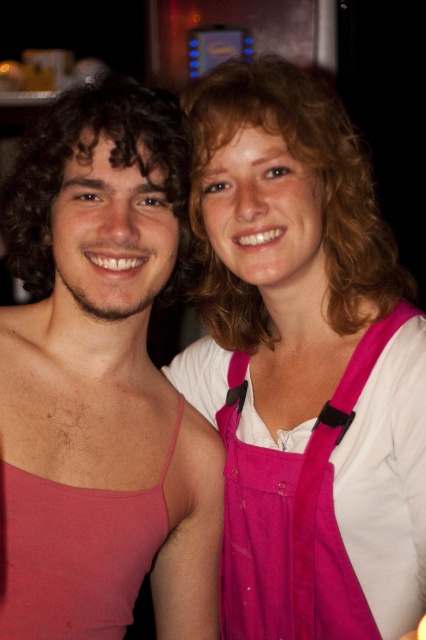
Question: Can you confirm if pink fabric dress at center is positioned to the right of pink matte tank top at center?

Choices:
 (A) yes
 (B) no

Answer: (A)

Question: Which point is closer to the camera?

Choices:
 (A) (94, 426)
 (B) (388, 420)

Answer: (B)

Question: Is pink fabric dress at center to the left of pink matte tank top at center from the viewer's perspective?

Choices:
 (A) no
 (B) yes

Answer: (A)

Question: Does pink fabric dress at center have a larger size compared to pink fabric apron at center?

Choices:
 (A) no
 (B) yes

Answer: (B)

Question: Which of the following is the closest to the observer?

Choices:
 (A) click(x=250, y=584)
 (B) click(x=161, y=381)
 (C) click(x=233, y=160)

Answer: (C)

Question: Among these objects, which one is farthest from the camera?

Choices:
 (A) pink fabric dress at center
 (B) pink fabric apron at center
 (C) pink matte tank top at center

Answer: (B)